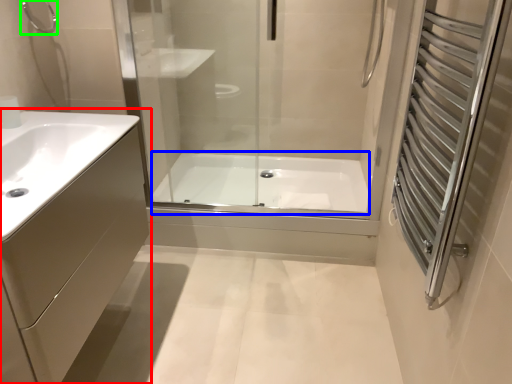
Question: Which is nearer to the bathroom cabinet (highlighted by a red box)? bath (highlighted by a blue box) or shower (highlighted by a green box).

Choices:
 (A) bath
 (B) shower

Answer: (B)